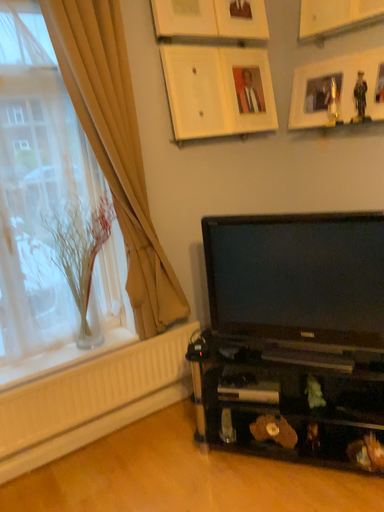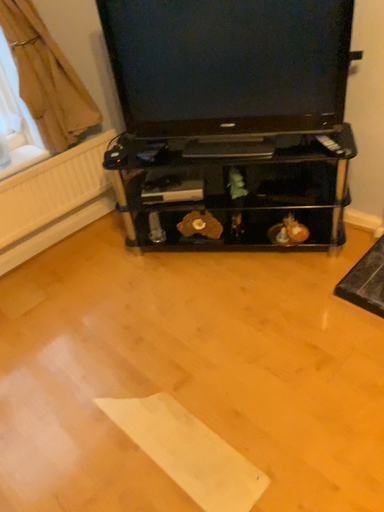
Question: Which way did the camera rotate in the video?

Choices:
 (A) rotated left
 (B) rotated right

Answer: (B)